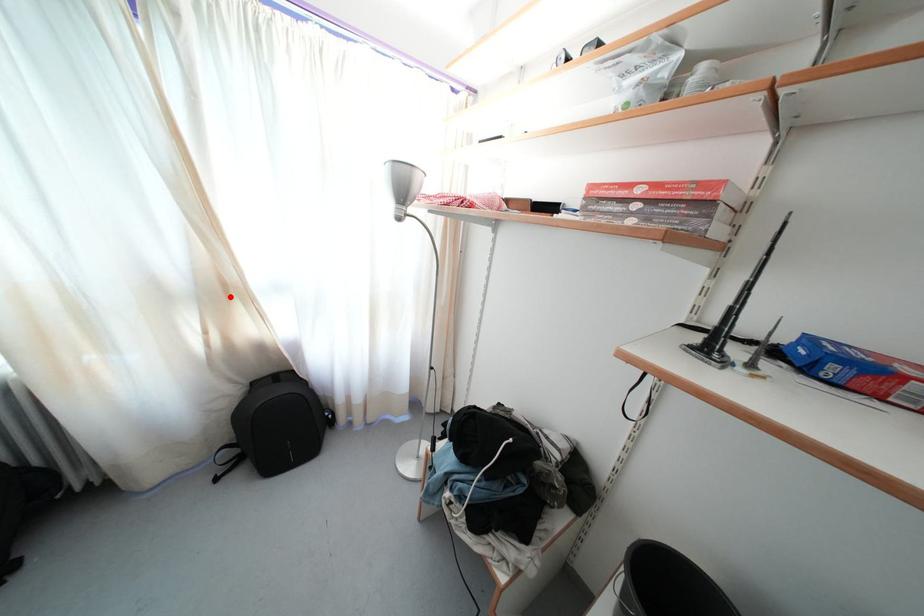
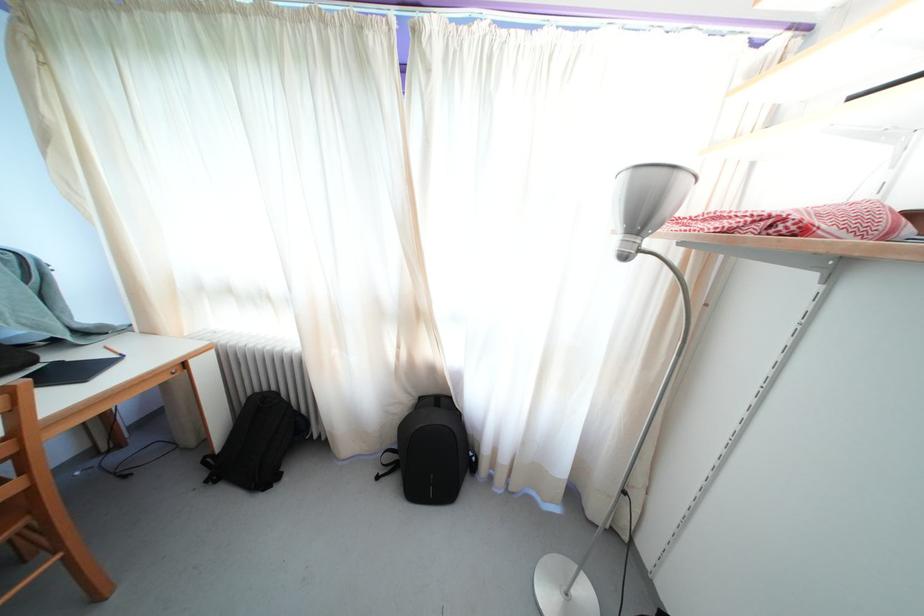
Locate, in the second image, the point that corresponds to the highlighted location in the first image.

(421, 321)